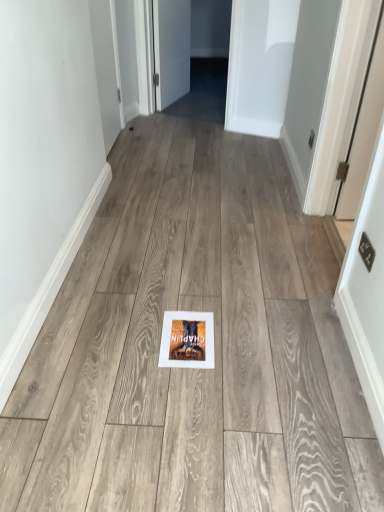
Where is `vacant region above matte gold postcard at center (from a real-world perspective)`? The height and width of the screenshot is (512, 384). vacant region above matte gold postcard at center (from a real-world perspective) is located at coordinates [185, 331].